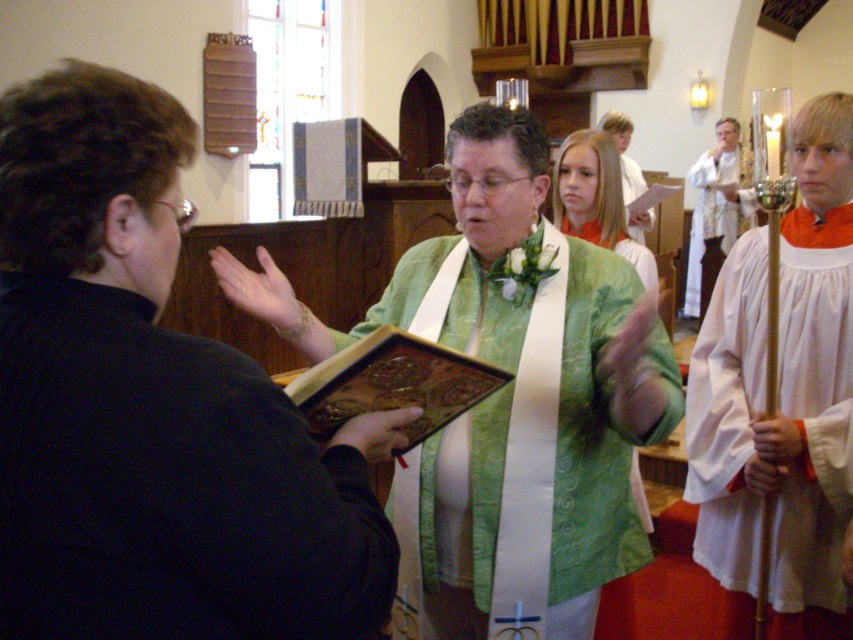
You are attending a religious service in the church and notice two robes worn by the clergy members. The green silk robe at center and the white satin robe at upper center. Based on their positions, which robe is closer to the altar located at the front of the church?

The white satin robe at upper center is closer to the altar since it is positioned above the green silk robe at center, indicating it is nearer to the front of the church.

You are attending a religious service in the church and need to locate the priest who is wearing a green silk robe at center and the altar server in a white satin robe at upper center. From your perspective facing the front of the church, which robe is positioned to the right?

The green silk robe at center is to the right of the white satin robe at upper center, so from your perspective facing the front of the church, the green silk robe at center is positioned to the right.

You are attending a religious service and see two clergy members in the front row. One is wearing a green satin robe at center and the other a white cotton robe at right. Which clergy member is standing to the left of the other?

The green satin robe at center is positioned on the left side of white cotton robe at right.